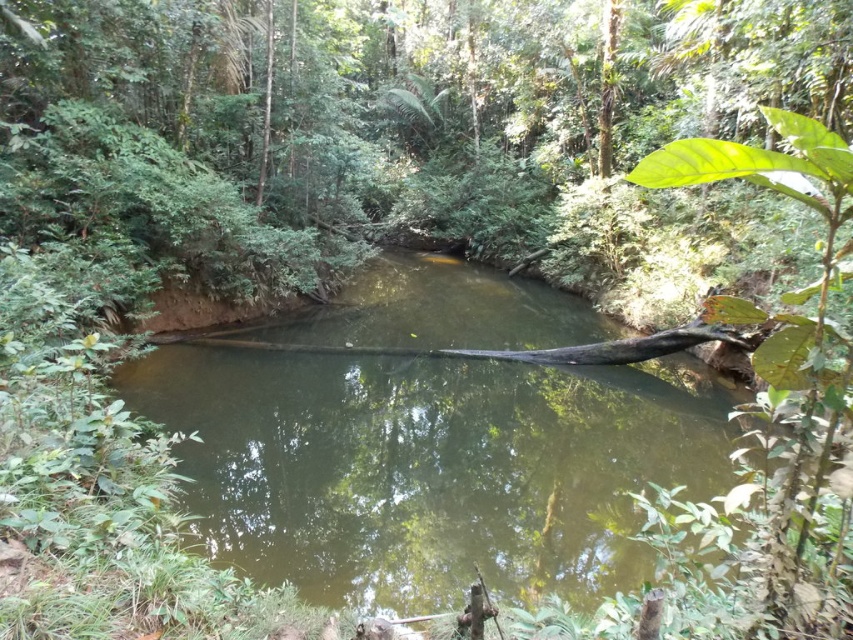
Is green murky water at center to the right of brown wood log at center from the viewer's perspective?

In fact, green murky water at center is to the left of brown wood log at center.

Is green murky water at center closer to camera compared to brown wood log at center?

Yes, green murky water at center is in front of brown wood log at center.

Between point (498, 531) and point (639, 356), which one is positioned behind?

The point (639, 356) is behind.

At what (x,y) coordinates should I click in order to perform the action: click on green murky water at center. Please return your answer as a coordinate pair (x, y). Looking at the image, I should click on (431, 467).